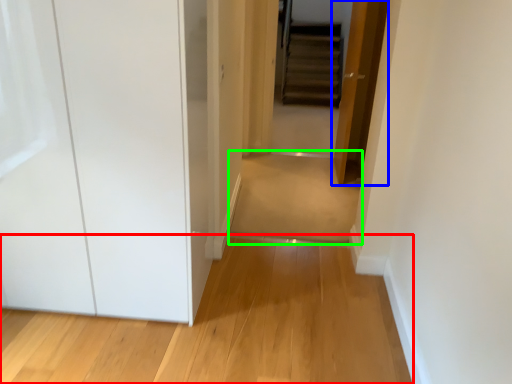
Question: Which is farther away from path (highlighted by a red box)? door (highlighted by a blue box) or path (highlighted by a green box)?

Choices:
 (A) door
 (B) path

Answer: (A)